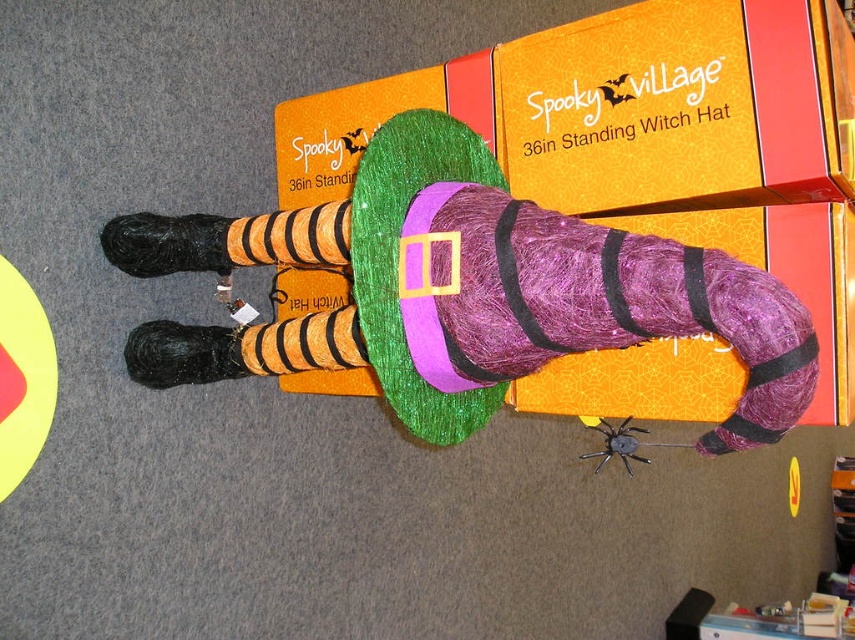
You are setting up a Halloween display and need to place a sign that will be 10 inches wide. The sign must be positioned to the left of the purple glittery witch hat at center. Given the hat is at coordinates approximately 0.458 on the x and 0.545 on the y, where should the sign be placed to ensure it is clearly visible and not overlapping with the hat?

The purple glittery witch hat at center is located at point 0.458 on the x and 0.545 on the y. To place the sign to the left without overlapping, position it at an x coordinate less than 0.458 while keeping the y coordinate around 0.545 for visibility.

You are setting up a Halloween display and have both the green glittery witch hat at center and the black matte spider at center. Which object takes up more space in the display?

The black matte spider at center occupies more space than the green glittery witch hat at center.

You are setting up a Halloween display and need to place a black matte spider at center on the green glittery witch hat at center. The spider is 2 centimeters in diameter. Is there enough space for the spider to fit on the hat without overlapping?

The green glittery witch hat at center and black matte spider at center are 73.86 centimeters apart from each other. Since the spider is only 2 centimeters in diameter, there is ample space between them to place the spider on the hat without overlapping.